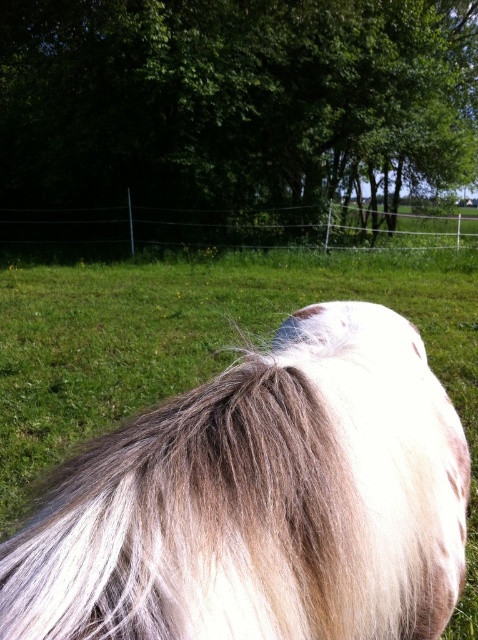
Question: Which of these objects is positioned farthest from the black wire fence at upper center?

Choices:
 (A) green leafy tree at upper center
 (B) white silky mane at center

Answer: (B)

Question: Can you confirm if white silky mane at center is wider than black wire fence at upper center?

Choices:
 (A) no
 (B) yes

Answer: (A)

Question: From the image, what is the correct spatial relationship of white silky mane at center in relation to green leafy tree at upper center?

Choices:
 (A) right
 (B) left

Answer: (B)

Question: Considering the real-world distances, which object is closest to the black wire fence at upper center?

Choices:
 (A) green leafy tree at upper center
 (B) white silky mane at center

Answer: (A)

Question: Which object is the closest to the black wire fence at upper center?

Choices:
 (A) white silky mane at center
 (B) green leafy tree at upper center

Answer: (B)

Question: Can you confirm if green leafy tree at upper center is wider than black wire fence at upper center?

Choices:
 (A) yes
 (B) no

Answer: (B)